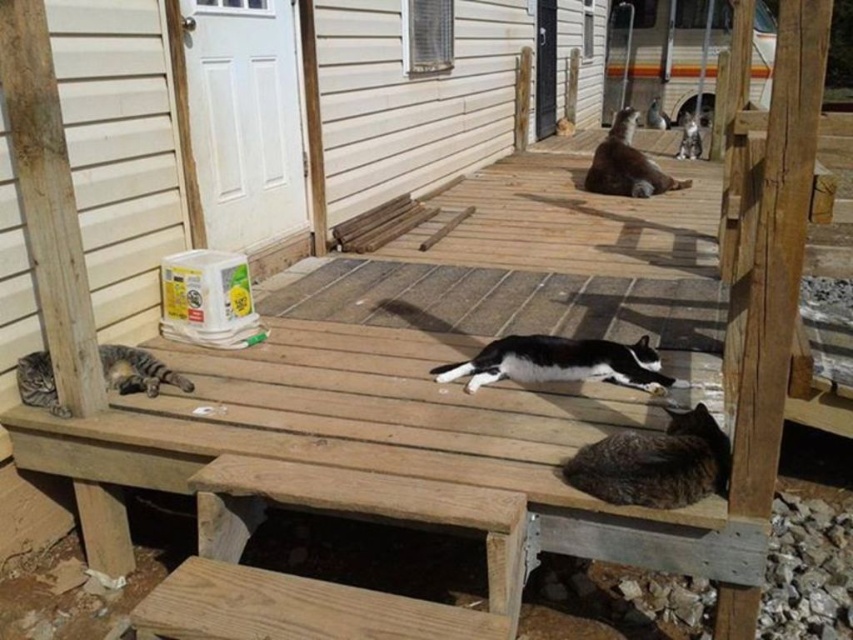
You are a cat owner who wants to place a new cat bed on the deck. You have two cats, the brown speckled fur cat at lower right and the brown fur cat at upper center. Which cat is located lower on the deck?

The brown speckled fur cat at lower right is located lower on the deck than the brown fur cat at upper center.